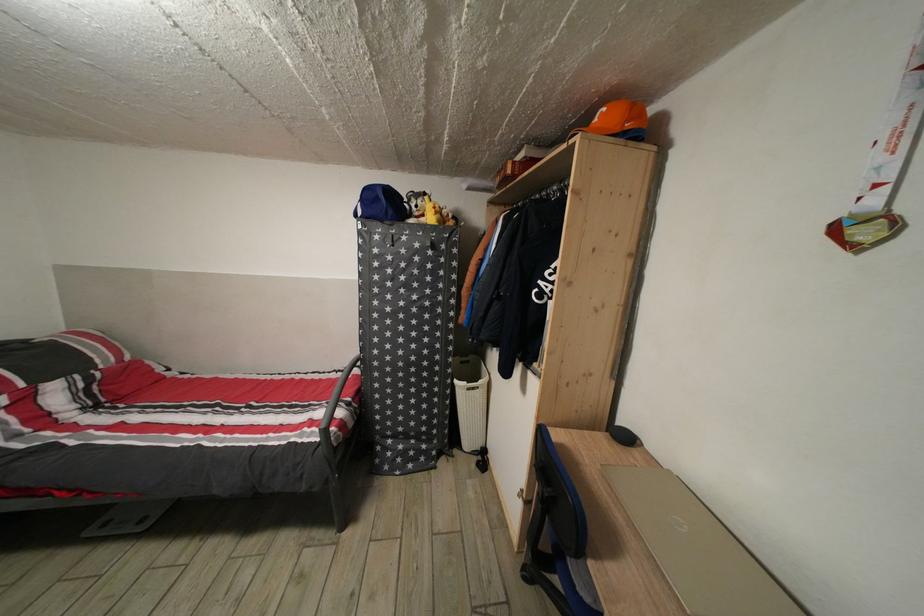
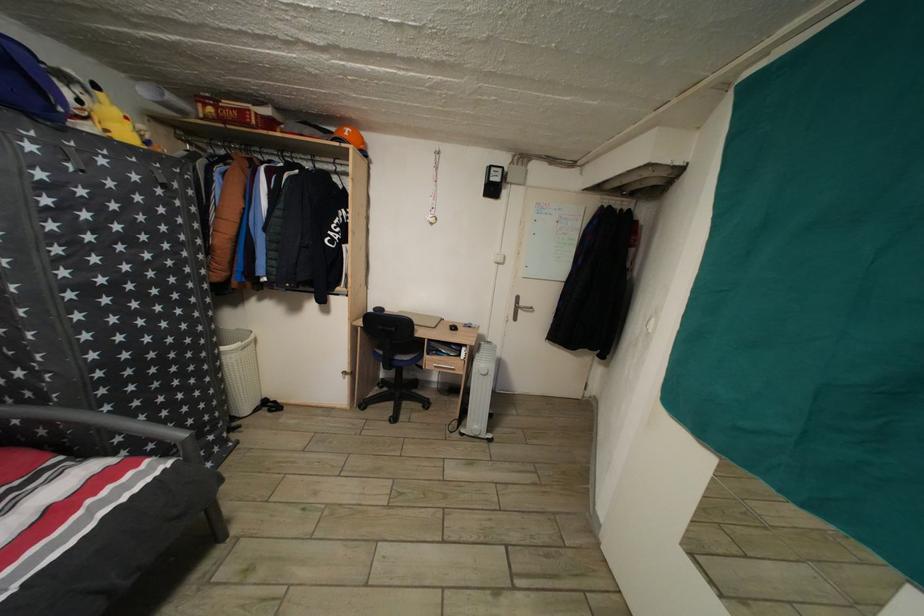
Where in the second image is the point corresponding to [602,126] from the first image?

(354, 140)